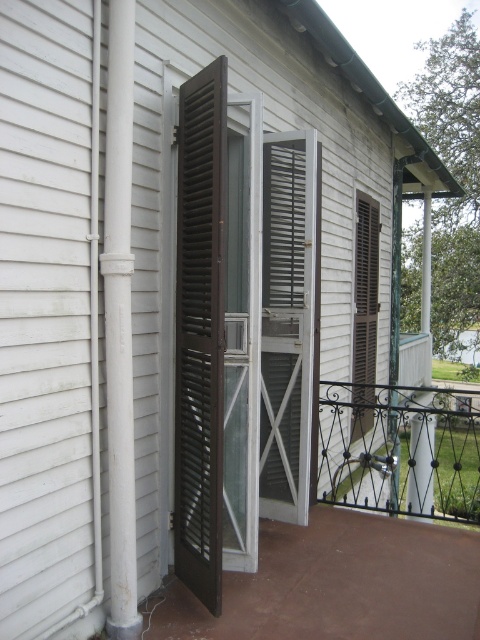
Is brown wooden screen door at left above brown wooden shutter at center?

Incorrect, brown wooden screen door at left is not positioned above brown wooden shutter at center.

I want to click on brown wooden screen door at left, so click(200, 332).

Can you confirm if brown wooden screen door at left is taller than white painted metal pipe at left?

Incorrect, brown wooden screen door at left's height is not larger of white painted metal pipe at left's.

Is point (204, 392) farther from viewer compared to point (116, 456)?

Yes, point (204, 392) is behind point (116, 456).

This screenshot has height=640, width=480. Describe the element at coordinates (200, 332) in the screenshot. I see `brown wooden screen door at left` at that location.

The width and height of the screenshot is (480, 640). I want to click on brown wooden screen door at left, so click(200, 332).

Between white painted metal pipe at left and brown wooden shutter at center, which one appears on the left side from the viewer's perspective?

white painted metal pipe at left

Who is higher up, white painted metal pipe at left or brown wooden shutter at center?

Positioned higher is brown wooden shutter at center.

The width and height of the screenshot is (480, 640). I want to click on white painted metal pipe at left, so click(x=120, y=321).